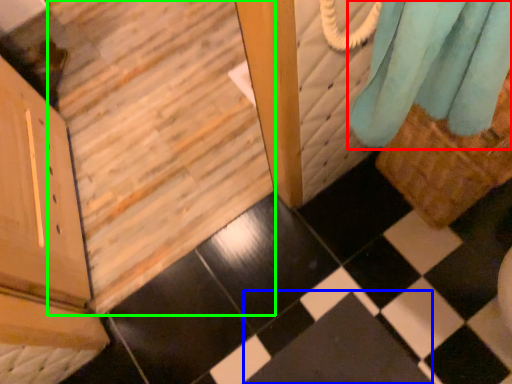
Question: Based on their relative distances, which object is nearer to curtain (highlighted by a red box)? Choose from square (highlighted by a blue box) and stairwell (highlighted by a green box).

Choices:
 (A) square
 (B) stairwell

Answer: (A)